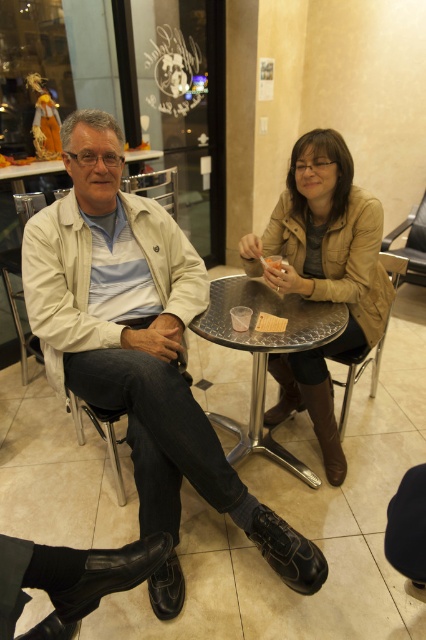
You are standing at the entrance of the cafe and see the point at coordinates (138, 340). What object is located at that point?

The point at coordinates (138, 340) indicates the matte beige jacket at left.